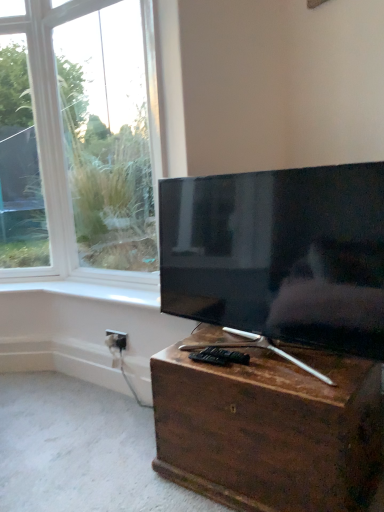
Find the location of a particular element. The height and width of the screenshot is (512, 384). vacant point above white glossy window sill at upper center (from a real-world perspective) is located at coordinates pyautogui.click(x=108, y=292).